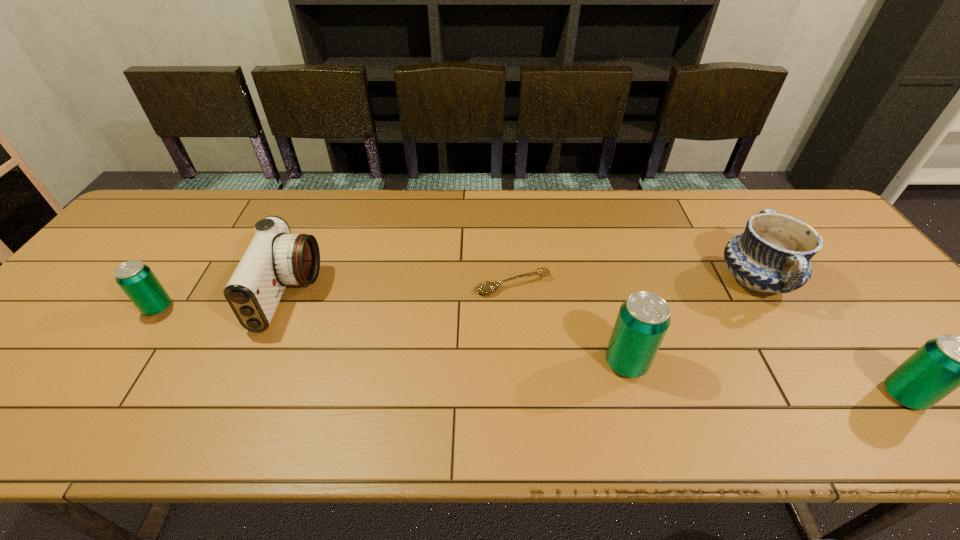
Where is `vacant position for inserting another beer_can evenly`? This screenshot has height=540, width=960. vacant position for inserting another beer_can evenly is located at coordinates (379, 334).